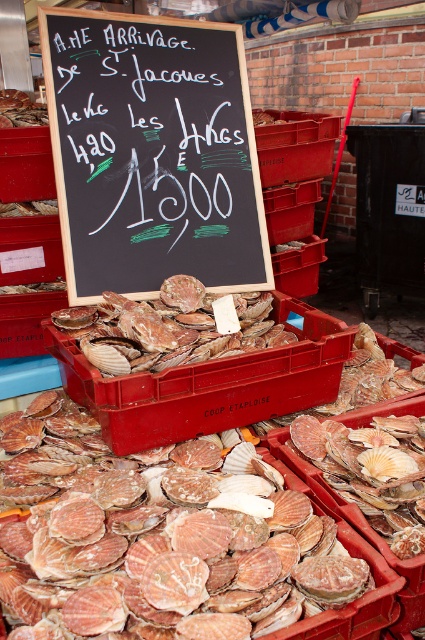
Who is shorter, black chalkboard at upper center or pinkish-brown shell at center?

With less height is pinkish-brown shell at center.

Is black chalkboard at upper center bigger than pinkish-brown shell at center?

Indeed, black chalkboard at upper center has a larger size compared to pinkish-brown shell at center.

The width and height of the screenshot is (425, 640). In order to click on black chalkboard at upper center in this screenshot , I will do `click(153, 154)`.

Is point (45, 470) less distant than point (107, 365)?

No.

Does point (147, 499) lie in front of point (156, 321)?

Yes, point (147, 499) is closer to viewer.

Find the location of a particular element. Image resolution: width=425 pixels, height=640 pixels. pinkish-brown shell at center is located at coordinates pyautogui.click(x=158, y=544).

Between point (110, 180) and point (118, 332), which one is positioned in front?

Point (118, 332) is in front.

Identify the location of black chalkboard at upper center. (153, 154).